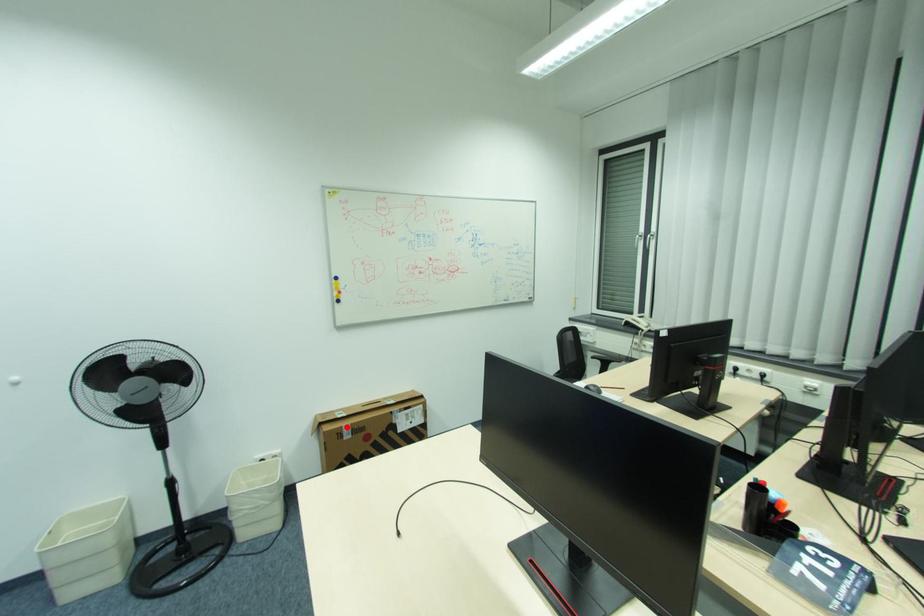
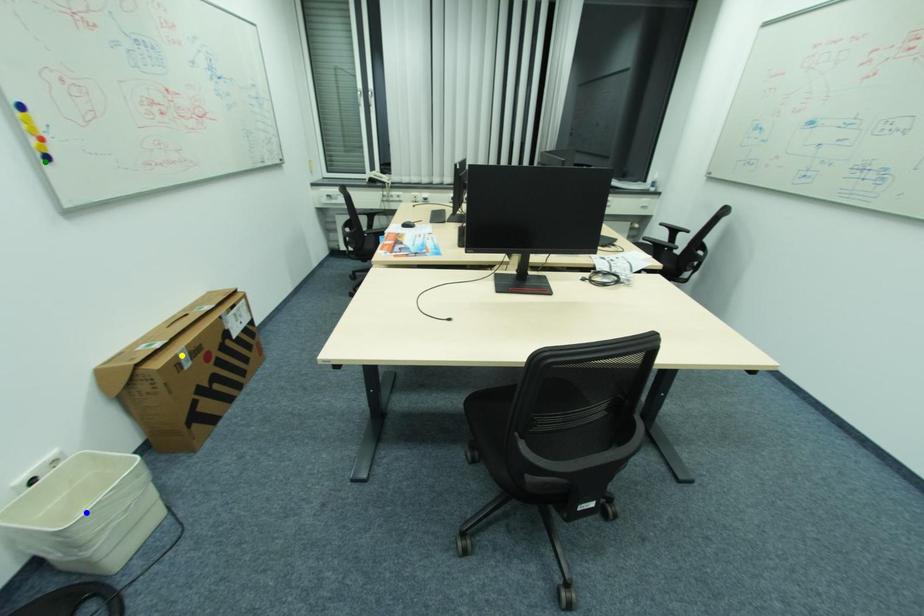
Question: I am providing you with two images of the same scene from different viewpoints. A red point is marked on the first image. You are given multiple points on the second image. In image 2, which mark is for the same physical point as the one in image 1?

Choices:
 (A) yellow point
 (B) green point
 (C) blue point

Answer: (A)